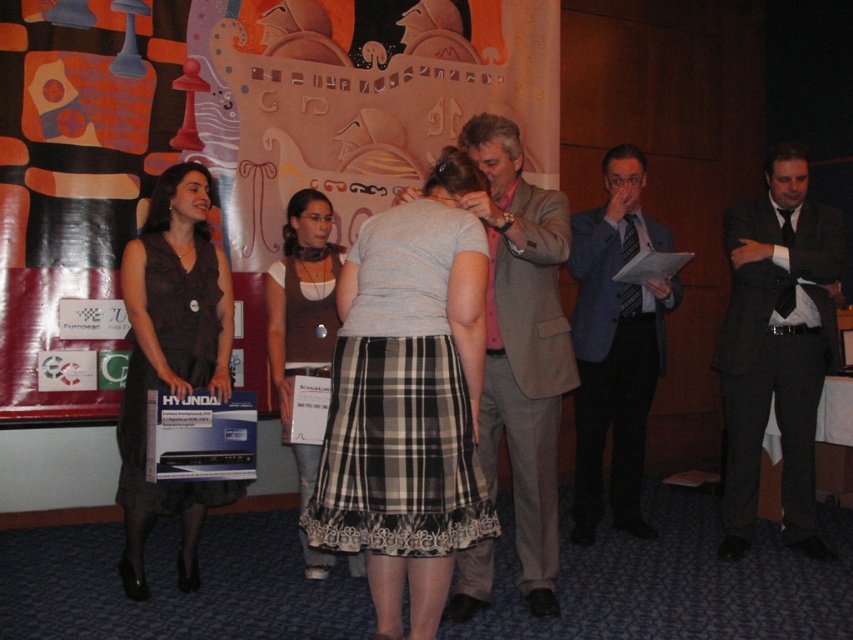
Question: Which is nearer to the blue suit at center?

Choices:
 (A) light brown textured suit at center
 (B) plaid fabric skirt at center
 (C) plastic box at center

Answer: (A)

Question: Which object is the closest to the plastic box at center?

Choices:
 (A) blue suit at center
 (B) gray cotton shirt at center
 (C) plaid skirt at center

Answer: (C)

Question: Is dark gray suit at right to the left of light brown textured suit at center from the viewer's perspective?

Choices:
 (A) no
 (B) yes

Answer: (A)

Question: Considering the relative positions of gray cotton shirt at center and plaid skirt at center in the image provided, where is gray cotton shirt at center located with respect to plaid skirt at center?

Choices:
 (A) left
 (B) right

Answer: (B)

Question: Which is nearer to the plaid fabric skirt at center?

Choices:
 (A) dark gray suit at right
 (B) plastic box at center

Answer: (A)

Question: Can you confirm if blue suit at center is positioned to the right of plaid skirt at center?

Choices:
 (A) no
 (B) yes

Answer: (B)